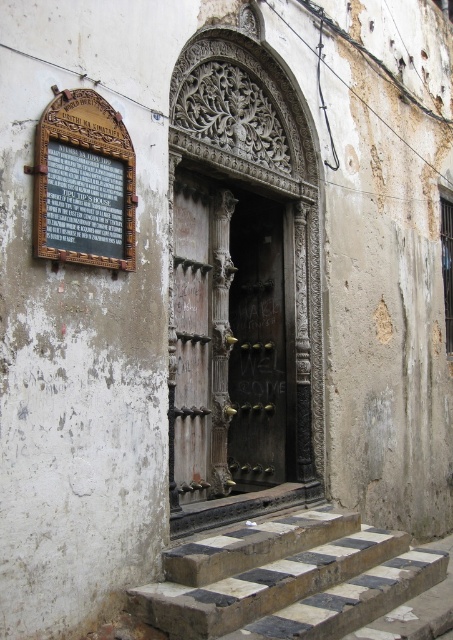
Which is more to the right, checkerboard stone steps at center or wooden plaque at upper left?

From the viewer's perspective, checkerboard stone steps at center appears more on the right side.

Is point (327, 556) positioned after point (44, 214)?

Yes, point (327, 556) is behind point (44, 214).

Locate an element on the screen. The width and height of the screenshot is (453, 640). checkerboard stone steps at center is located at coordinates (287, 579).

Is point (202, 476) positioned behind point (289, 634)?

Yes, point (202, 476) is behind point (289, 634).

Between wooden carved door at center and checkerboard stone steps at center, which one appears on the right side from the viewer's perspective?

Positioned to the right is checkerboard stone steps at center.

I want to click on wooden carved door at center, so click(229, 342).

Describe the element at coordinates (83, 182) in the screenshot. I see `wooden plaque at upper left` at that location.

Does wooden plaque at upper left appear under dark wood door at center?

Incorrect, wooden plaque at upper left is not positioned below dark wood door at center.

This screenshot has width=453, height=640. What do you see at coordinates (83, 182) in the screenshot?
I see `wooden plaque at upper left` at bounding box center [83, 182].

Image resolution: width=453 pixels, height=640 pixels. In order to click on wooden plaque at upper left in this screenshot , I will do `click(83, 182)`.